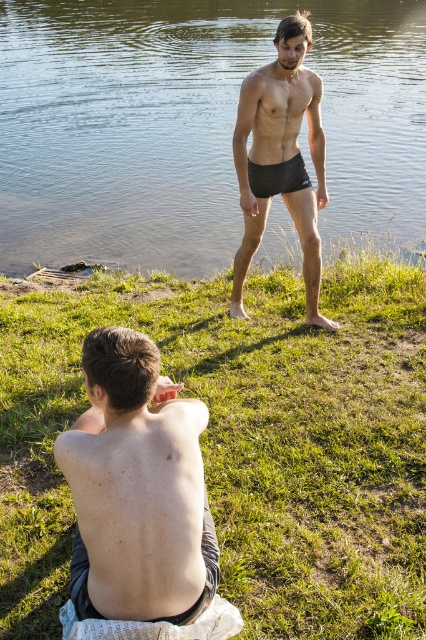
Can you confirm if smooth skin back at center is positioned below black matte shorts at center?

Correct, smooth skin back at center is located below black matte shorts at center.

I want to click on smooth skin back at center, so click(x=137, y=488).

At what (x,y) coordinates should I click in order to perform the action: click on smooth skin back at center. Please return your answer as a coordinate pair (x, y). This screenshot has width=426, height=640. Looking at the image, I should click on (137, 488).

Can you confirm if clear water at center is wider than smooth skin back at center?

Indeed, clear water at center has a greater width compared to smooth skin back at center.

Which is behind, point (238, 44) or point (147, 397)?

The point (238, 44) is more distant.

The image size is (426, 640). In order to click on clear water at center in this screenshot , I will do pyautogui.click(x=192, y=124).

Does green grass at center appear under clear water at center?

Yes.

Between point (264, 387) and point (405, 28), which one is positioned in front?

Point (264, 387) is more forward.

Locate an element on the screen. The width and height of the screenshot is (426, 640). green grass at center is located at coordinates (244, 442).